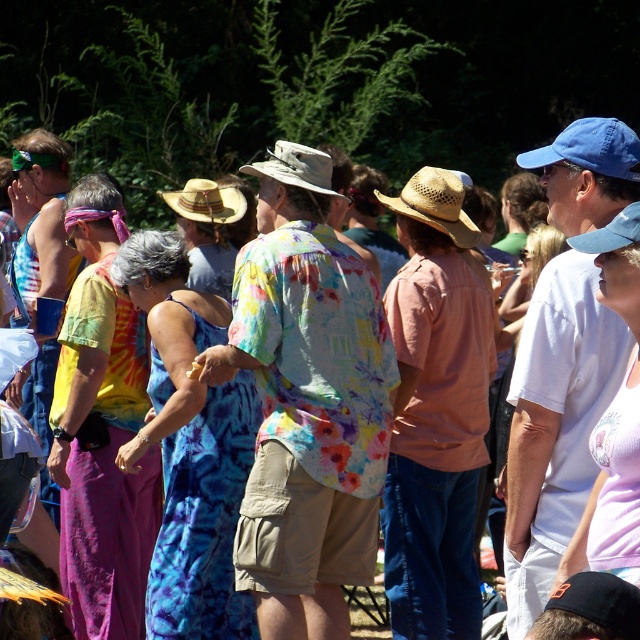
You are at the festival and want to wear a hat that stands out more in the crowd. Which hat between the camouflage fabric cowboy hat at center and the natural straw cowboy hat at center is taller?

The camouflage fabric cowboy hat at center is taller than the natural straw cowboy hat at center, so it would stand out more in the crowd.